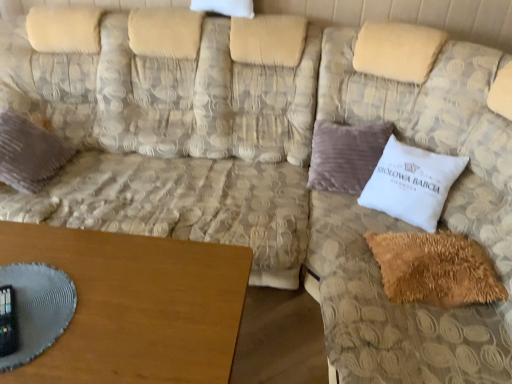
Question: Considering the relative sizes of brown wooden table at lower left and beige textured couch at upper right, marked as the 2th couch in a left-to-right arrangement, in the image provided, is brown wooden table at lower left bigger than beige textured couch at upper right, marked as the 2th couch in a left-to-right arrangement,?

Choices:
 (A) yes
 (B) no

Answer: (B)

Question: Is brown wooden table at lower left next to beige textured couch at upper right, marked as the 2th couch in a left-to-right arrangement?

Choices:
 (A) no
 (B) yes

Answer: (A)

Question: Is brown wooden table at lower left to the right of beige textured couch at upper right, marked as the 2th couch in a left-to-right arrangement, from the viewer's perspective?

Choices:
 (A) yes
 (B) no

Answer: (B)

Question: Is brown wooden table at lower left oriented towards beige textured couch at upper right, marked as the 2th couch in a left-to-right arrangement?

Choices:
 (A) no
 (B) yes

Answer: (A)

Question: Does brown wooden table at lower left appear on the left side of beige textured couch at upper right, marked as the 2th couch in a left-to-right arrangement?

Choices:
 (A) yes
 (B) no

Answer: (A)

Question: Can you confirm if brown wooden table at lower left is taller than beige textured couch at upper right, marked as the 2th couch in a left-to-right arrangement?

Choices:
 (A) yes
 (B) no

Answer: (B)

Question: Does beige textured couch at upper right, marked as the 2th couch in a left-to-right arrangement, have a lesser width compared to brown fuzzy pillow at lower right, placed as the second pillow when sorted from left to right?

Choices:
 (A) no
 (B) yes

Answer: (A)

Question: From the image's perspective, is beige textured couch at upper right, marked as the 2th couch in a left-to-right arrangement, below brown fuzzy pillow at lower right, placed as the second pillow when sorted from left to right?

Choices:
 (A) no
 (B) yes

Answer: (A)

Question: Is beige textured couch at upper right, positioned as the 1th couch in right-to-left order, at the left side of brown fuzzy pillow at lower right, positioned as the 2th pillow in right-to-left order?

Choices:
 (A) no
 (B) yes

Answer: (A)

Question: Is beige textured couch at upper right, marked as the 2th couch in a left-to-right arrangement, looking in the opposite direction of brown fuzzy pillow at lower right, placed as the second pillow when sorted from left to right?

Choices:
 (A) no
 (B) yes

Answer: (B)

Question: Does beige textured couch at upper right, marked as the 2th couch in a left-to-right arrangement, have a greater width compared to brown fuzzy pillow at lower right, placed as the second pillow when sorted from left to right?

Choices:
 (A) no
 (B) yes

Answer: (B)

Question: Considering the relative positions of beige textured couch at upper right, positioned as the 1th couch in right-to-left order, and brown fuzzy pillow at lower right, placed as the second pillow when sorted from left to right, in the image provided, is beige textured couch at upper right, positioned as the 1th couch in right-to-left order, to the right of brown fuzzy pillow at lower right, placed as the second pillow when sorted from left to right, from the viewer's perspective?

Choices:
 (A) no
 (B) yes

Answer: (B)

Question: Can you confirm if beige textured couch at upper right, marked as the 2th couch in a left-to-right arrangement, is smaller than velvet purple pillow at left, which is the third pillow from right to left?

Choices:
 (A) no
 (B) yes

Answer: (A)